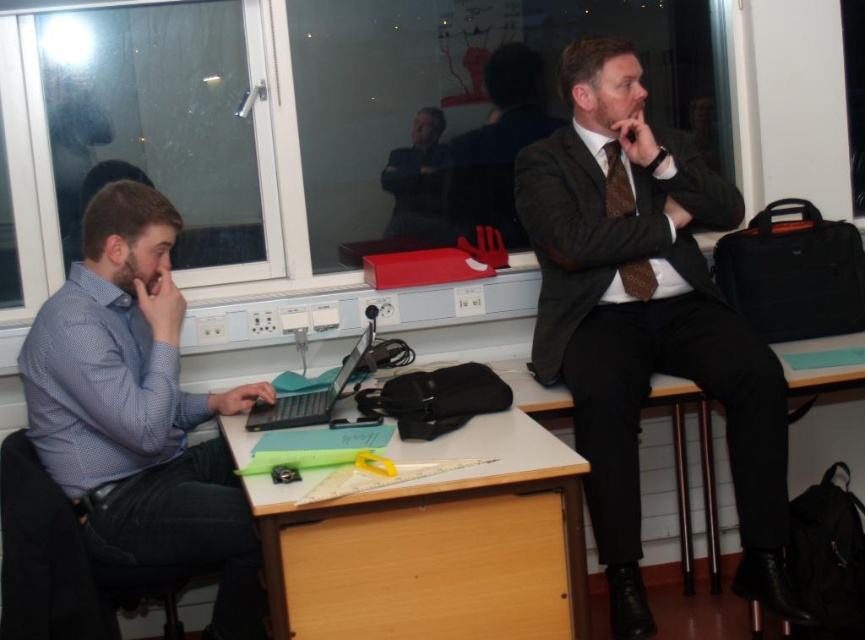
You are standing in the classroom and need to determine which person is taller based on their clothing. Which is taller, the blue dotted shirt at left or the dark gray suit at center?

The blue dotted shirt at left is taller than the dark gray suit at center according to the description.

You are standing in the classroom and need to reach the teal plastic laptop at center. The blue dotted shirt at left is in your way. Can you walk around it without bending down?

The blue dotted shirt at left is much taller than the teal plastic laptop at center, so you would need to bend down to walk around it since the blue dotted shirt at left is taller and may block your path.